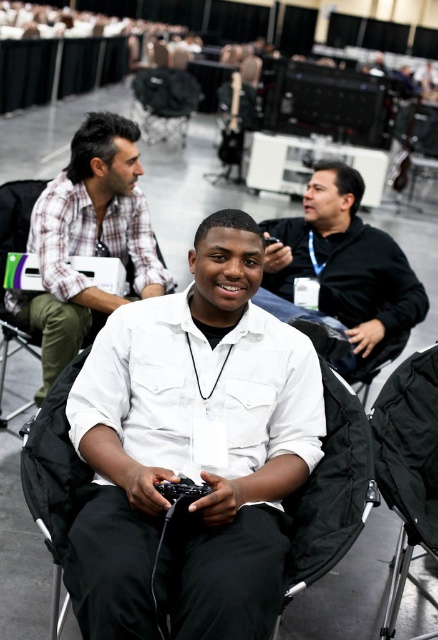
You are a photographer standing at the back of the room. You need to take a photo of the white matte shirt at center and the black fabric chair at lower right in the same frame. Can you fit both objects in the photo without moving your position?

The white matte shirt at center and black fabric chair at lower right are 66.13 centimeters apart. Since the distance between them is less than the camera sensor width, you can fit both objects in the photo without moving your position.

Based on the scene description, can you determine the relative positions of the white plaid shirt at upper left and the black fabric chair at lower right? Specifically, which object is positioned to the left of the other?

The white plaid shirt at upper left is positioned to the left of the black fabric chair at lower right.